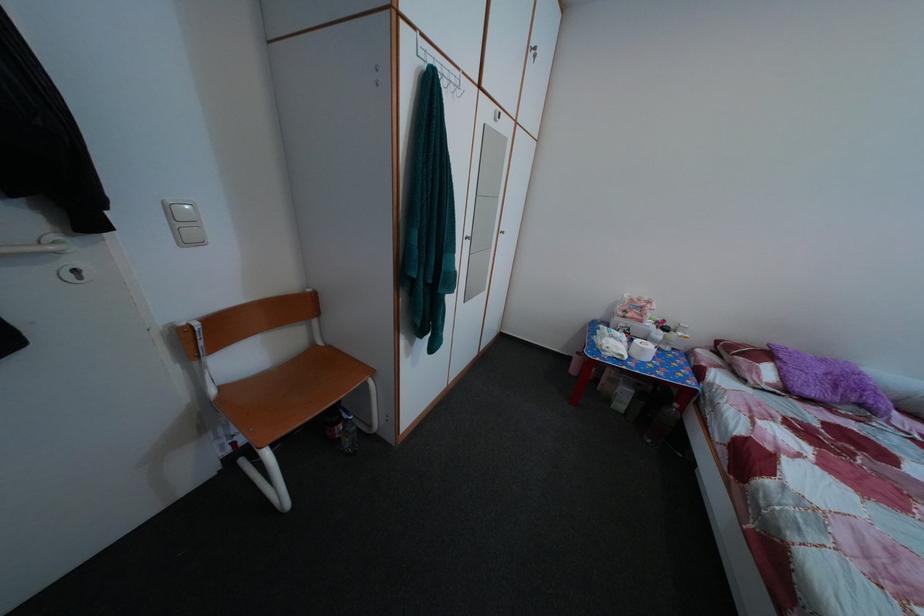
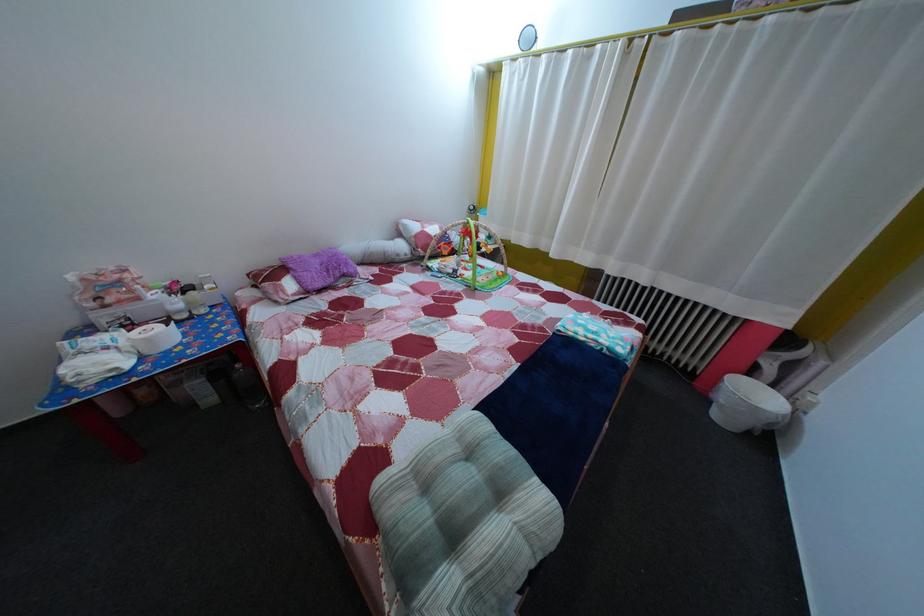
The first image is from the beginning of the video and the second image is from the end. How did the camera likely rotate when shooting the video?

The camera's rotation is toward right-down.